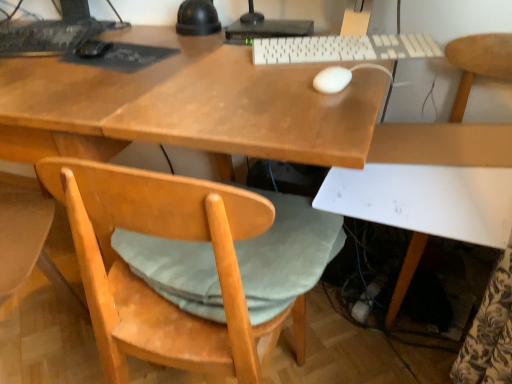
This screenshot has width=512, height=384. Identify the location of free space to the back side of white matte mouse at center, which is the 2th mouse from back to front. (315, 60).